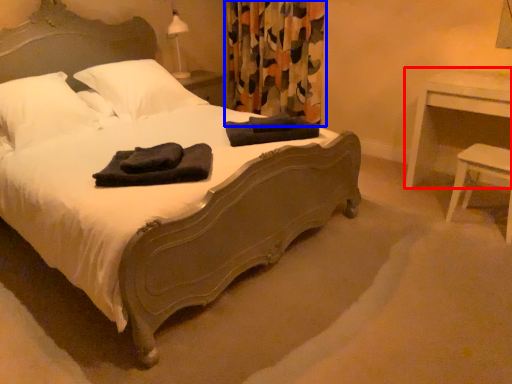
Question: Which of the following is the farthest to the observer, nightstand (highlighted by a red box) or curtain (highlighted by a blue box)?

Choices:
 (A) nightstand
 (B) curtain

Answer: (B)